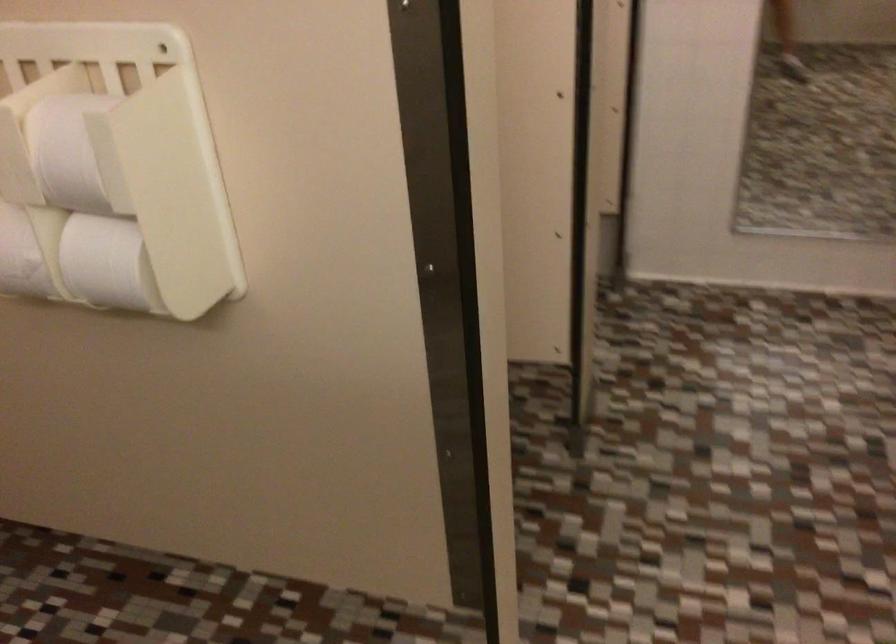
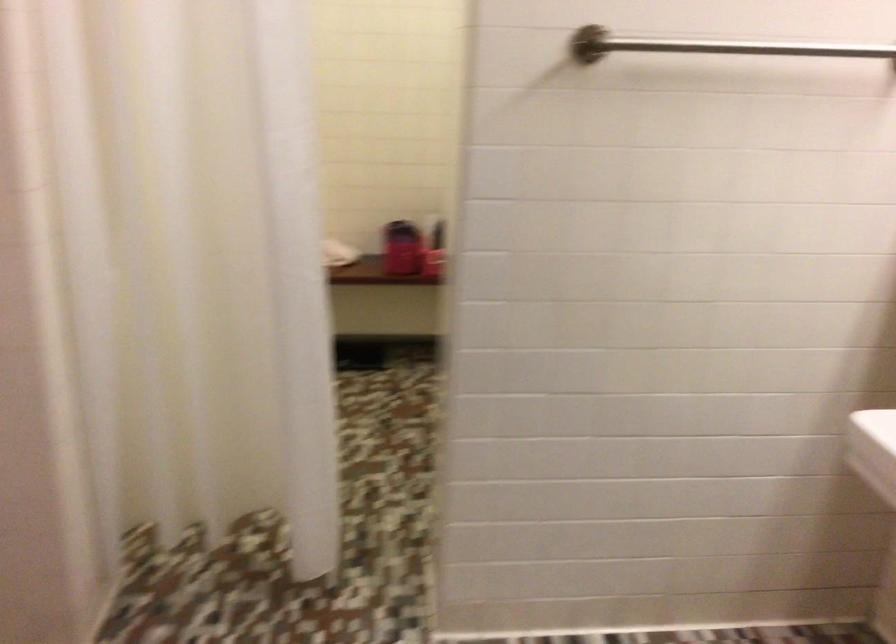
How did the camera likely rotate?

The camera's rotation is toward right-down.